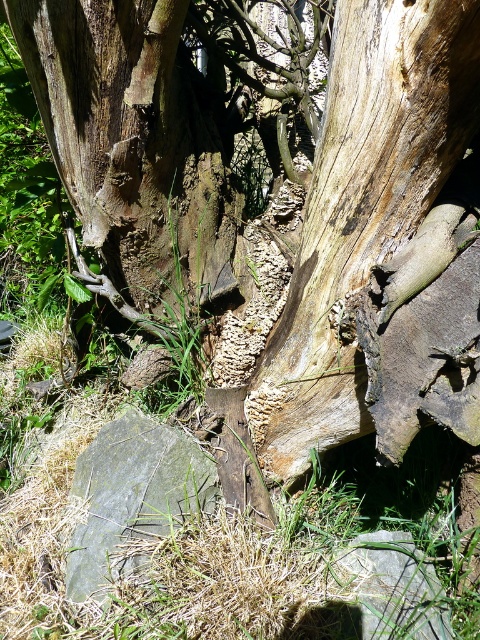
You are a botanist examining the decaying tree trunk. You notice the light brown rough bark at center. Can you determine its exact position relative to the image edges using the coordinate system provided?

The light brown rough bark at center is located at point coordinates of 0.325 on the x axis and 0.754 on the y axis.

You are a hiker trying to determine the best spot to place your heavy backpack. You see the light brown rough bark at center and the gray slate rock at lower left. Which object would provide a more stable base for your backpack?

The light brown rough bark at center is larger in size than the gray slate rock at lower left, so it would provide a more stable base for your backpack.